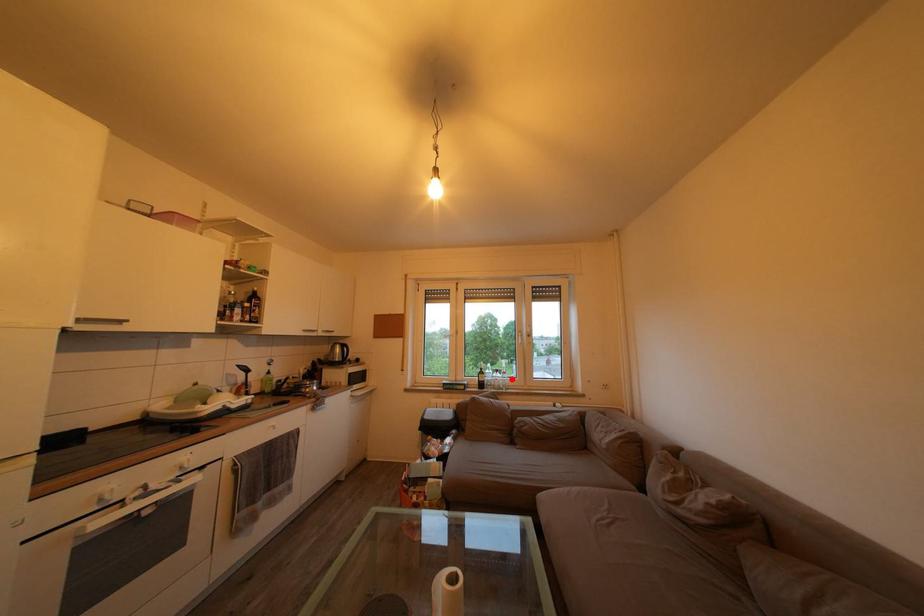
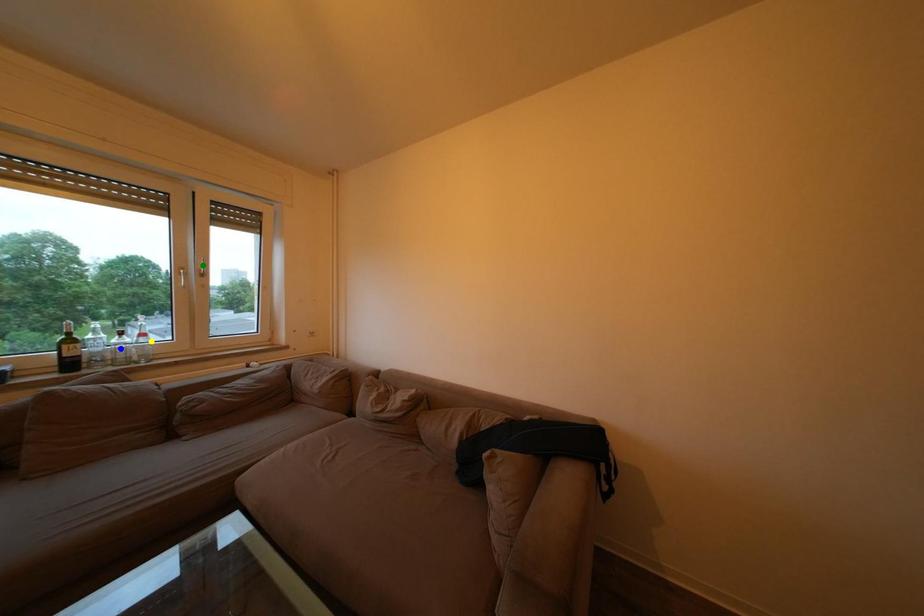
Question: I am providing you with two images of the same scene from different viewpoints. A red point is marked on the first image. You are given multiple points on the second image. Which spot in image 2 lines up with the point in image 1?

Choices:
 (A) green point
 (B) yellow point
 (C) blue point

Answer: (B)